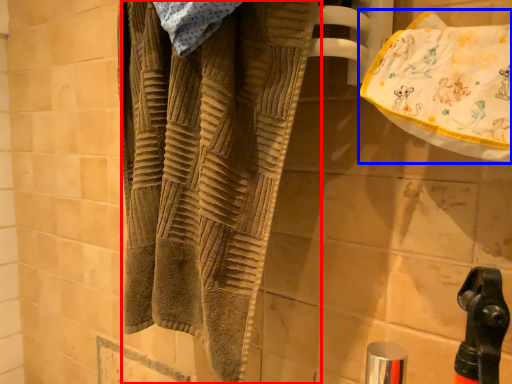
Question: Which point is further to the camera, towel (highlighted by a red box) or beach towel (highlighted by a blue box)?

Choices:
 (A) towel
 (B) beach towel

Answer: (A)